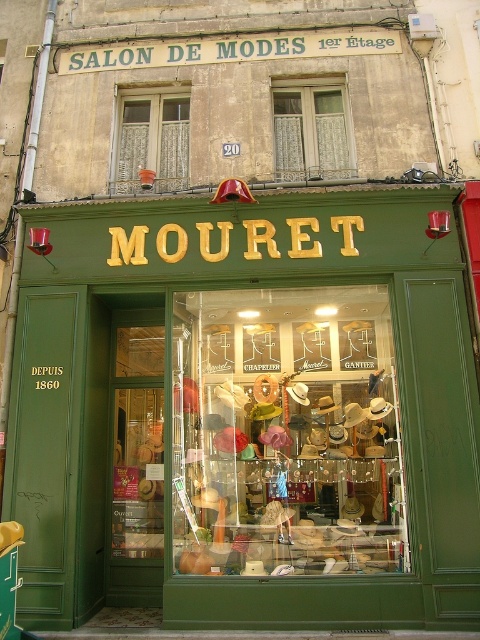
Does green matte storefront at center have a greater width compared to multicolored fabric hats at center?

Yes, green matte storefront at center is wider than multicolored fabric hats at center.

Is green matte storefront at center shorter than multicolored fabric hats at center?

Yes, green matte storefront at center is shorter than multicolored fabric hats at center.

Is point (151, 600) less distant than point (225, 563)?

No, it is not.

Identify the location of green matte storefront at center. (248, 412).

Does multicolored fabric hats at center appear under white lace curtains at upper center?

Yes.

This screenshot has height=640, width=480. Identify the location of multicolored fabric hats at center. (286, 433).

Is clear glass window at center to the left of white lace curtains at upper center from the viewer's perspective?

In fact, clear glass window at center is to the right of white lace curtains at upper center.

Measure the distance from clear glass window at center to white lace curtains at upper center.

clear glass window at center and white lace curtains at upper center are 4.71 feet apart.

Is point (334, 104) closer to viewer compared to point (176, 161)?

No, (334, 104) is behind (176, 161).

Find the location of a particular element. Image resolution: width=480 pixels, height=640 pixels. clear glass window at center is located at coordinates (311, 132).